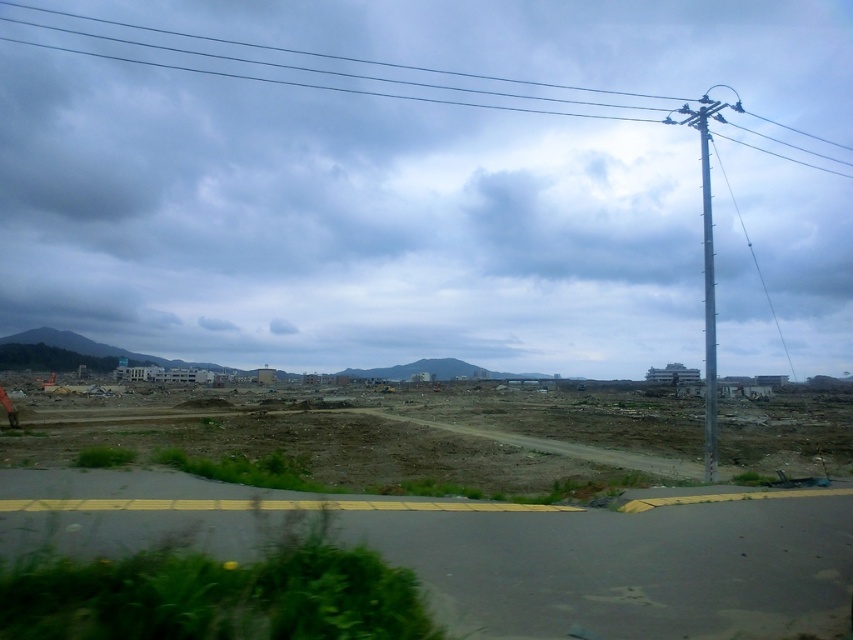
Question: Does metallic wire at upper center come behind silver metallic telegraph pole at right?

Choices:
 (A) yes
 (B) no

Answer: (A)

Question: Which object appears closest to the camera in this image?

Choices:
 (A) metallic wire at upper center
 (B) cloudy sky at upper center

Answer: (B)

Question: Considering the relative positions of metallic wire at upper center and silver metallic telegraph pole at right in the image provided, where is metallic wire at upper center located with respect to silver metallic telegraph pole at right?

Choices:
 (A) above
 (B) below

Answer: (A)

Question: Can you confirm if cloudy sky at upper center is bigger than silver metallic telegraph pole at right?

Choices:
 (A) no
 (B) yes

Answer: (B)

Question: Which of these objects is positioned closest to the cloudy sky at upper center?

Choices:
 (A) silver metallic telegraph pole at right
 (B) metallic wire at upper center

Answer: (B)

Question: Which object is the closest to the cloudy sky at upper center?

Choices:
 (A) metallic wire at upper center
 (B) silver metallic telegraph pole at right

Answer: (A)